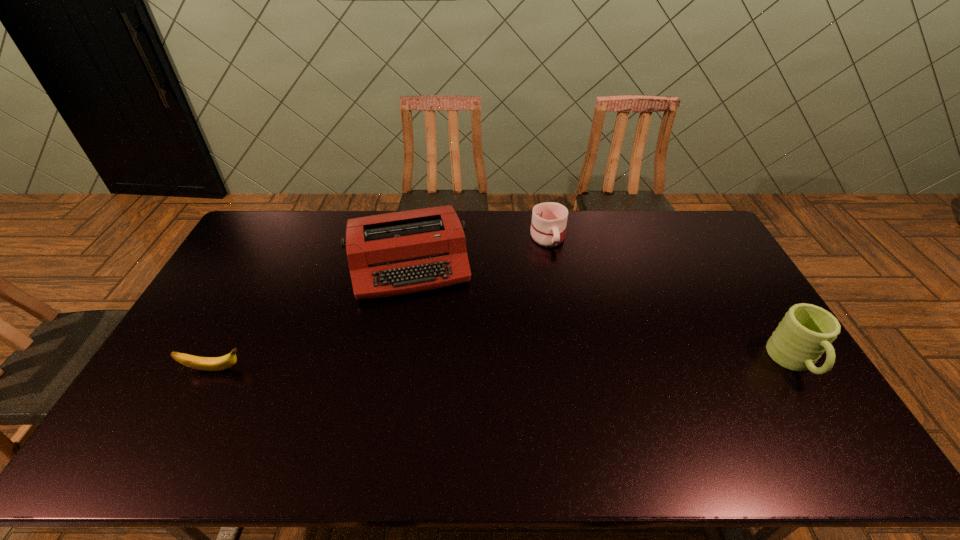
In order to click on free space on the desktop that is between the shortest object and the nearer mug and is positioned on the typing side of the typewriter in this screenshot , I will do `click(429, 367)`.

This screenshot has width=960, height=540. In order to click on vacant space on the desktop that is between the leftmost object and the taller mug and is positioned on the side with the handle of the left mug in this screenshot , I will do `click(588, 365)`.